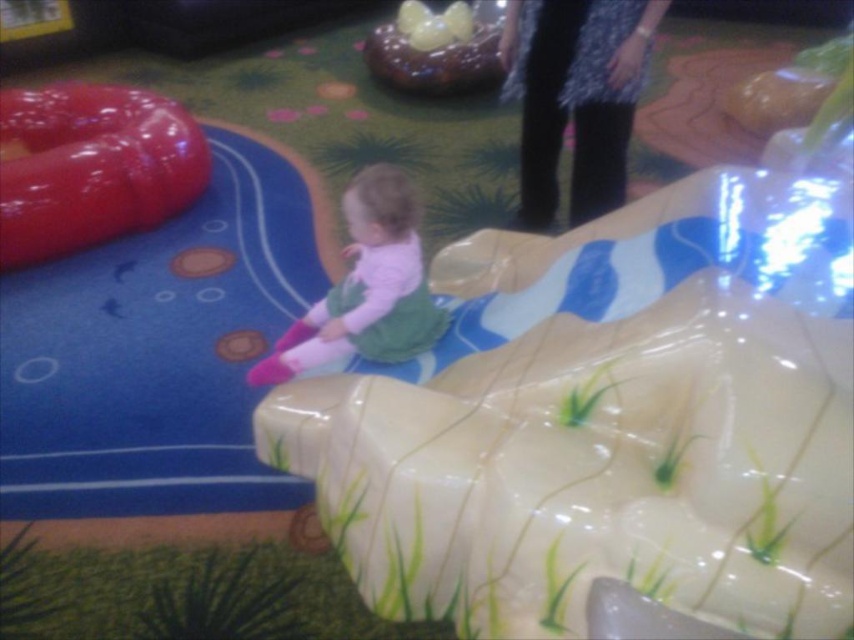
Question: Is pink fabric toddler at center to the left of shiny chocolate cake at upper center from the viewer's perspective?

Choices:
 (A) yes
 (B) no

Answer: (A)

Question: Which point is farther to the camera?

Choices:
 (A) glossy plastic slide at left
 (B) pink fabric toddler at center

Answer: (A)

Question: Where is glossy plastic slide at left located in relation to pink fabric toddler at center in the image?

Choices:
 (A) below
 (B) above

Answer: (B)

Question: Does glossy plastic slide at left appear over shiny chocolate cake at upper center?

Choices:
 (A) no
 (B) yes

Answer: (A)

Question: Which of the following is the closest to the observer?

Choices:
 (A) (410, 324)
 (B) (9, 99)

Answer: (A)

Question: Which object is closer to the camera taking this photo?

Choices:
 (A) glossy plastic slide at left
 (B) shiny chocolate cake at upper center
 (C) pink fabric toddler at center

Answer: (C)